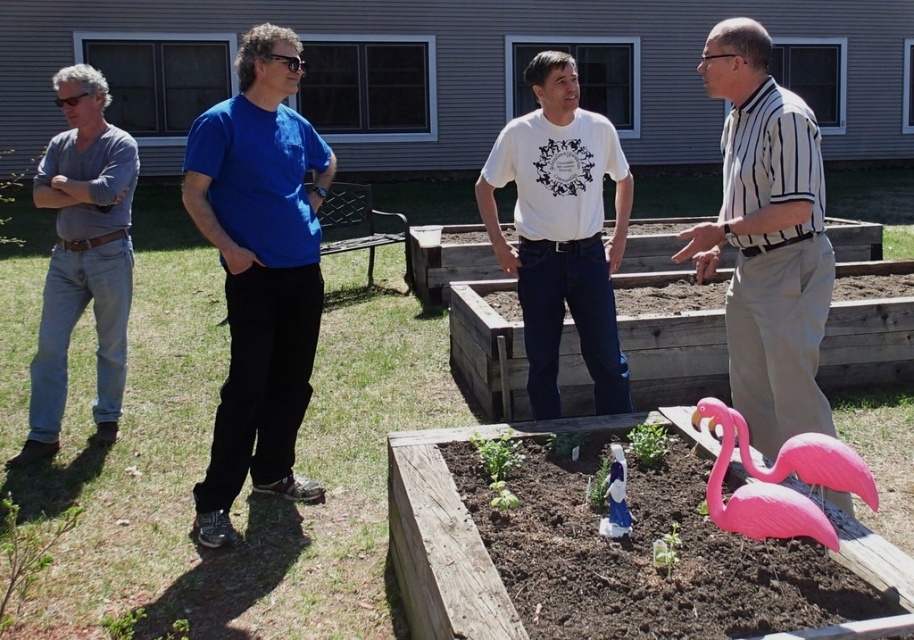
Is striped cotton shirt at right smaller than white cotton t-shirt at center?

Indeed, striped cotton shirt at right has a smaller size compared to white cotton t-shirt at center.

Is striped cotton shirt at right thinner than white cotton t-shirt at center?

Yes.

Is point (800, 362) positioned after point (596, 392)?

No, (800, 362) is closer to viewer.

Identify the location of striped cotton shirt at right. This screenshot has width=914, height=640. (767, 240).

Between point (123, 132) and point (750, 531), which one is positioned in front?

Point (750, 531)

Who is shorter, denim jeans at left or pink plastic flamingo at lower right?

pink plastic flamingo at lower right

This screenshot has width=914, height=640. Describe the element at coordinates (82, 257) in the screenshot. I see `denim jeans at left` at that location.

Identify the location of denim jeans at left. (82, 257).

Is blue t-shirt at center positioned at the back of denim jeans at left?

No, it is not.

Is point (222, 387) positioned before point (33, 372)?

Yes, point (222, 387) is in front of point (33, 372).

At what (x,y) coordinates should I click in order to perform the action: click on blue t-shirt at center. Please return your answer as a coordinate pair (x, y). This screenshot has height=640, width=914. Looking at the image, I should click on (259, 269).